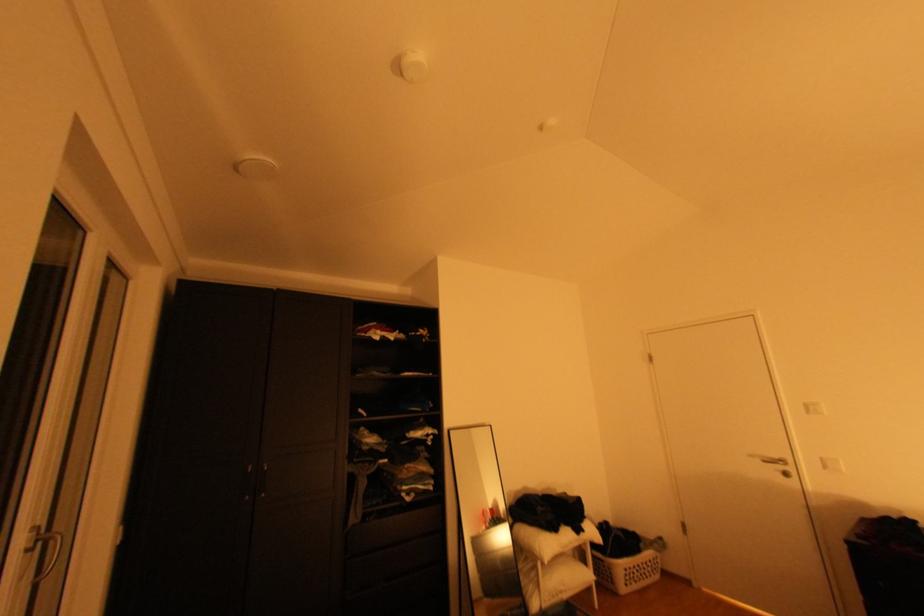
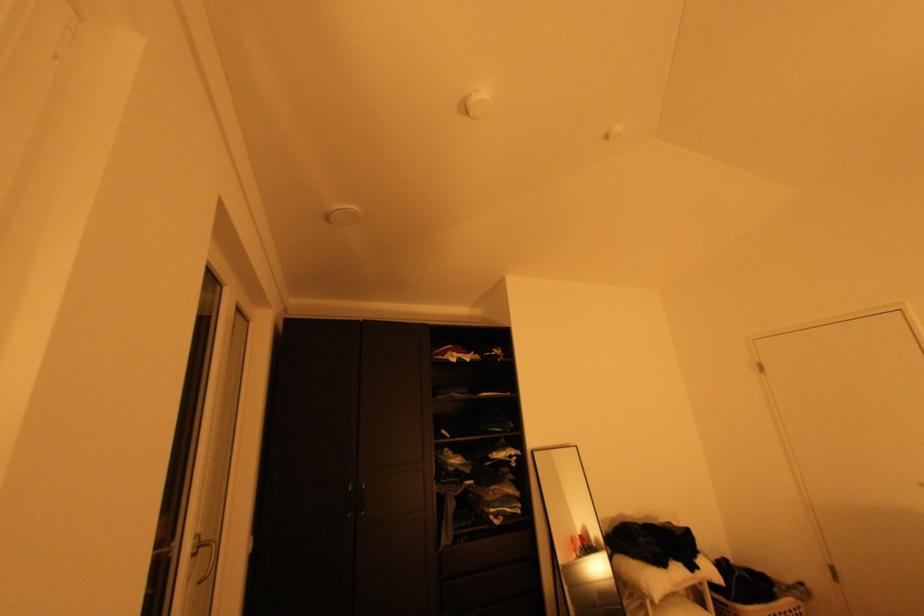
Question: The camera is either moving clockwise (left) or counter-clockwise (right) around the object. The first image is from the beginning of the video and the second image is from the end. Is the camera moving left or right when shooting the video?

Choices:
 (A) Left
 (B) Right

Answer: (B)